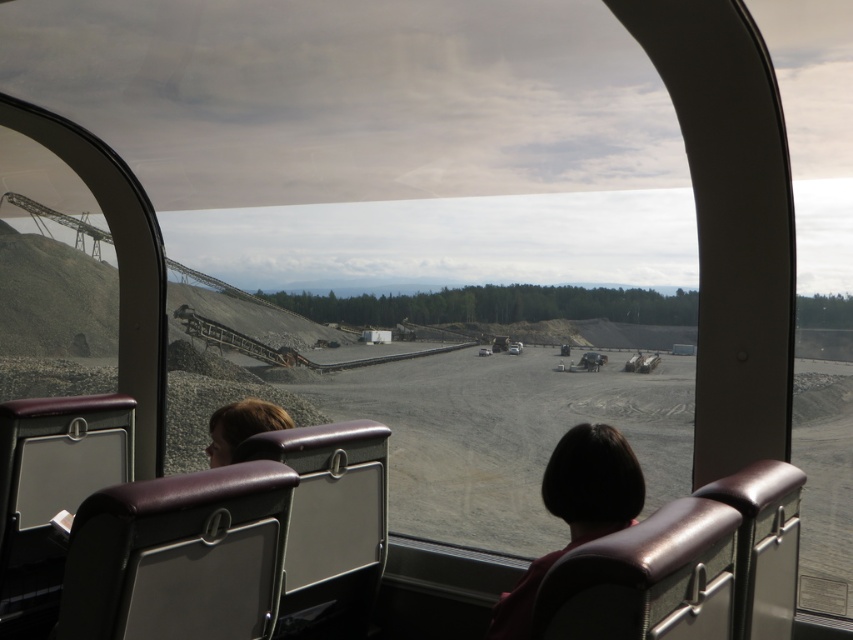
Can you confirm if dark brown hair at center is positioned to the left of brown hair at left?

Incorrect, dark brown hair at center is not on the left side of brown hair at left.

Is point (494, 605) farther from camera compared to point (236, 432)?

No, (494, 605) is closer to viewer.

Is point (526, 589) less distant than point (216, 428)?

Yes, it is.

Identify the location of dark brown hair at center. This screenshot has width=853, height=640. 576,509.